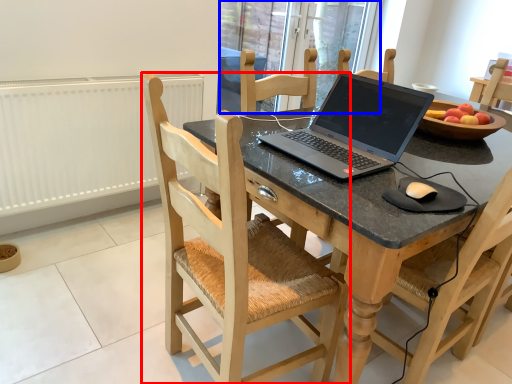
Question: Which object appears farthest to the camera in this image, chair (highlighted by a red box) or glass door (highlighted by a blue box)?

Choices:
 (A) chair
 (B) glass door

Answer: (B)